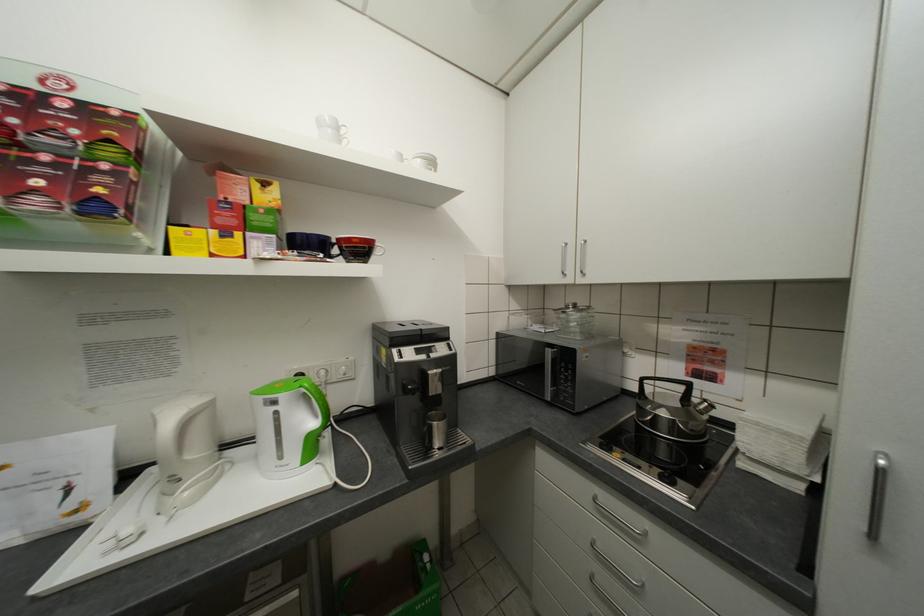
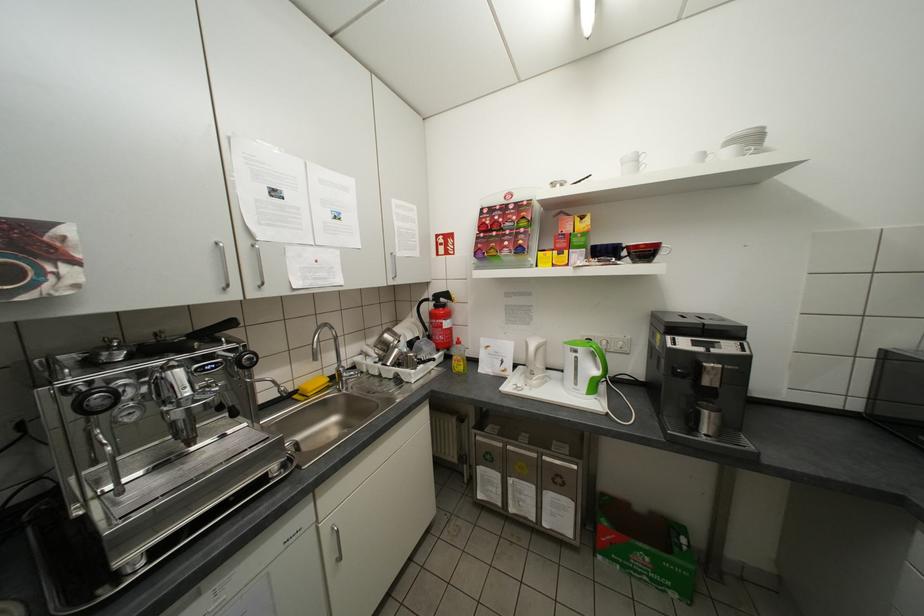
Where in the second image is the point corresponding to point 447,448 from the first image?

(714, 436)